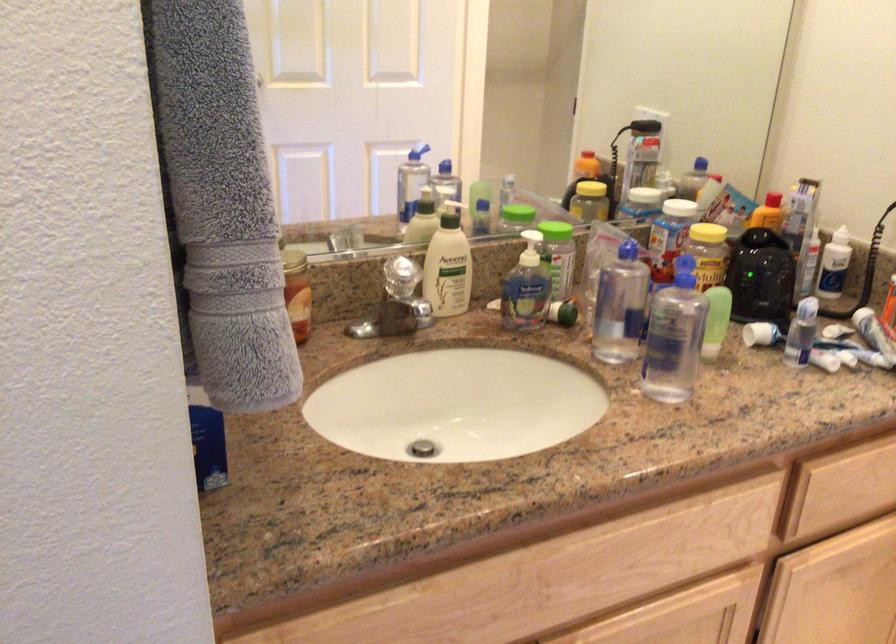
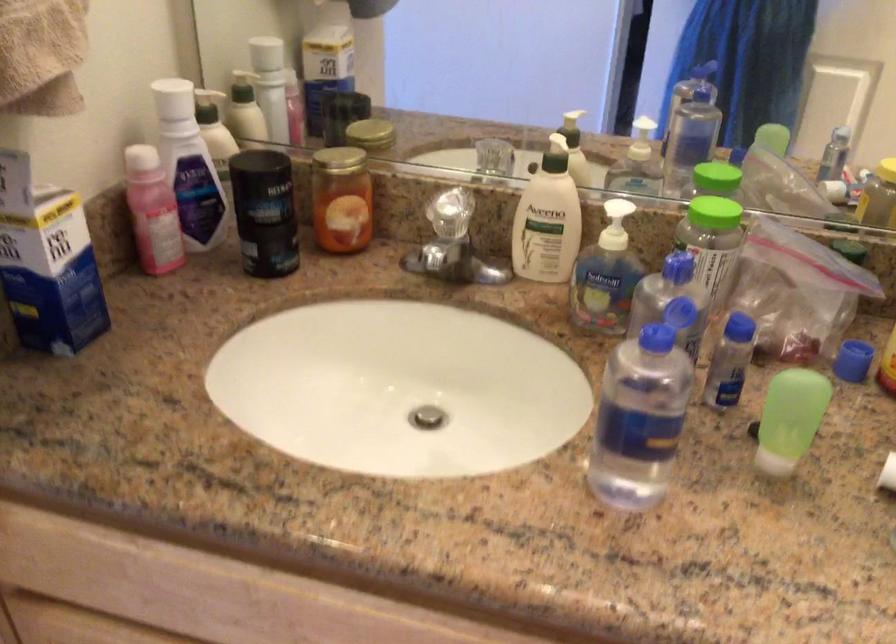
The point at (295, 257) is marked in the first image. Where is the corresponding point in the second image?

(336, 160)